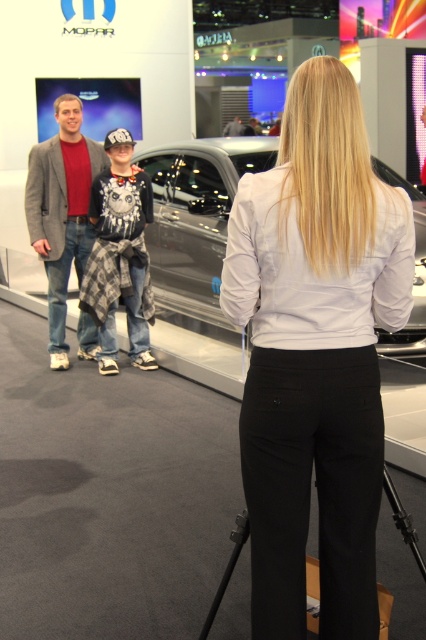
Question: Does gray wool blazer at left lie in front of dark gray suit at center?

Choices:
 (A) yes
 (B) no

Answer: (A)

Question: Which point is closer to the camera?

Choices:
 (A) (314, 564)
 (B) (340, 182)

Answer: (B)

Question: Which object is the farthest from the black matte tripod at lower center?

Choices:
 (A) gray wool blazer at left
 (B) white smooth shirt at center
 (C) dark gray suit at center

Answer: (C)

Question: Observing the image, what is the correct spatial positioning of white smooth shirt at center in reference to glossy metallic car at center?

Choices:
 (A) above
 (B) below

Answer: (B)

Question: Can you confirm if gray wool blazer at left is positioned to the right of black matte tripod at lower center?

Choices:
 (A) yes
 (B) no

Answer: (B)

Question: Which object is positioned farthest from the gray wool blazer at left?

Choices:
 (A) dark gray suit at center
 (B) white smooth shirt at center
 (C) black matte tripod at lower center

Answer: (A)